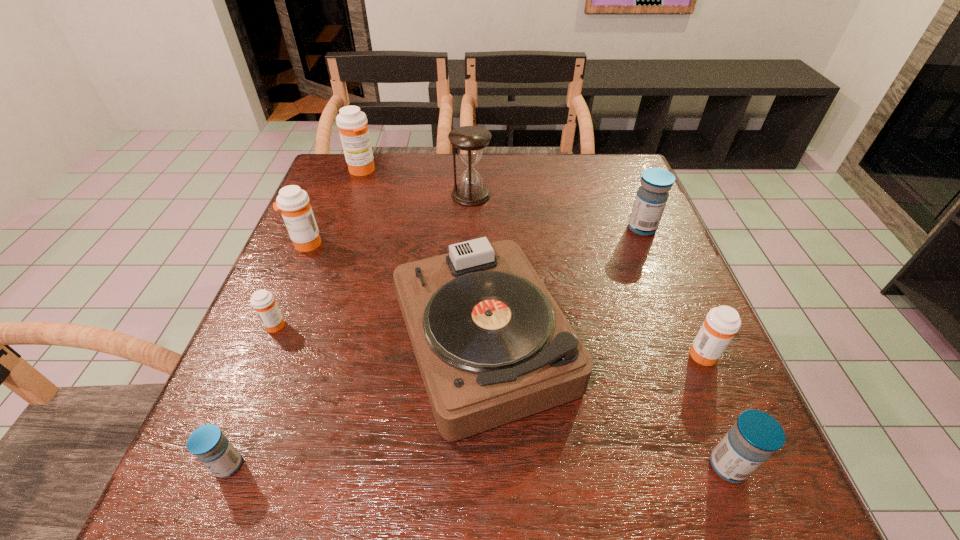
I want to click on free space located on the right of the smallest orange medicine, so click(x=441, y=324).

Where is `medicine present at the far edge`? Image resolution: width=960 pixels, height=540 pixels. medicine present at the far edge is located at coordinates (352, 123).

In order to click on hourglass positioned at the far edge in this screenshot , I will do `click(469, 140)`.

What are the coordinates of `object that is at the far left corner` in the screenshot? It's located at (352, 123).

Find the location of a particular element. object that is positioned at the near left corner is located at coordinates (207, 443).

Where is `object located in the near right corner section of the desktop`? object located in the near right corner section of the desktop is located at coordinates (756, 435).

Find the location of a particular element. vacant area at the far edge of the desktop is located at coordinates (556, 173).

At what (x,y) coordinates should I click in order to perform the action: click on free location at the near edge of the desktop. Please return your answer as a coordinate pair (x, y). This screenshot has height=540, width=960. Looking at the image, I should click on (286, 498).

Identify the location of vacant space at the left edge of the desktop. This screenshot has width=960, height=540. (258, 318).

In the image, there is a desktop. At what (x,y) coordinates should I click in order to perform the action: click on vacant space at the right edge. Please return your answer as a coordinate pair (x, y). The height and width of the screenshot is (540, 960). Looking at the image, I should click on (671, 258).